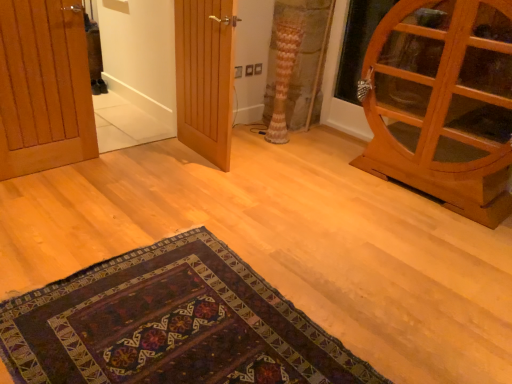
Where is `vacant area that lies between wooden cabinet at right, positioned as the 1th door in right-to-left order, and wooden door at left, placed as the third door when sorted from right to left`? vacant area that lies between wooden cabinet at right, positioned as the 1th door in right-to-left order, and wooden door at left, placed as the third door when sorted from right to left is located at coordinates (265, 188).